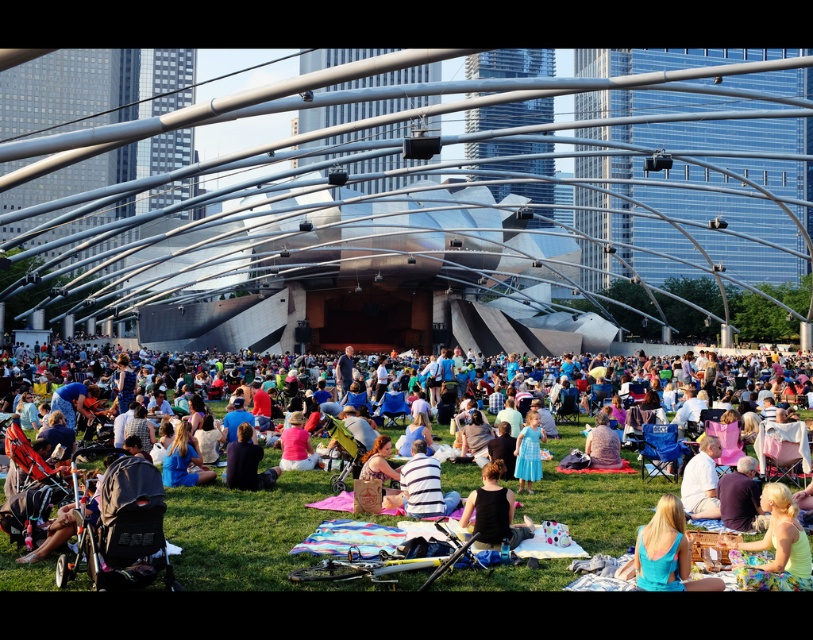
Question: Which point is closer to the camera?

Choices:
 (A) matte blue dress at lower right
 (B) dark purple shirt at lower right
 (C) light yellow tank top at lower right

Answer: (A)

Question: Is light yellow tank top at lower right thinner than black fabric dress at center?

Choices:
 (A) yes
 (B) no

Answer: (B)

Question: Does blonde hair at center lie in front of matte pink dress at center?

Choices:
 (A) yes
 (B) no

Answer: (A)

Question: Which object is the closest to the light blue satin dress at center?

Choices:
 (A) light brown fabric dress at center
 (B) black fabric dress at center

Answer: (A)

Question: Is light blue satin dress at center smaller than blonde hair at center?

Choices:
 (A) no
 (B) yes

Answer: (A)

Question: Which object is positioned farthest from the blonde hair at center?

Choices:
 (A) black fabric dress at center
 (B) light brown fabric shirt at center
 (C) light blue satin dress at center
 (D) white cotton shirt at center

Answer: (B)